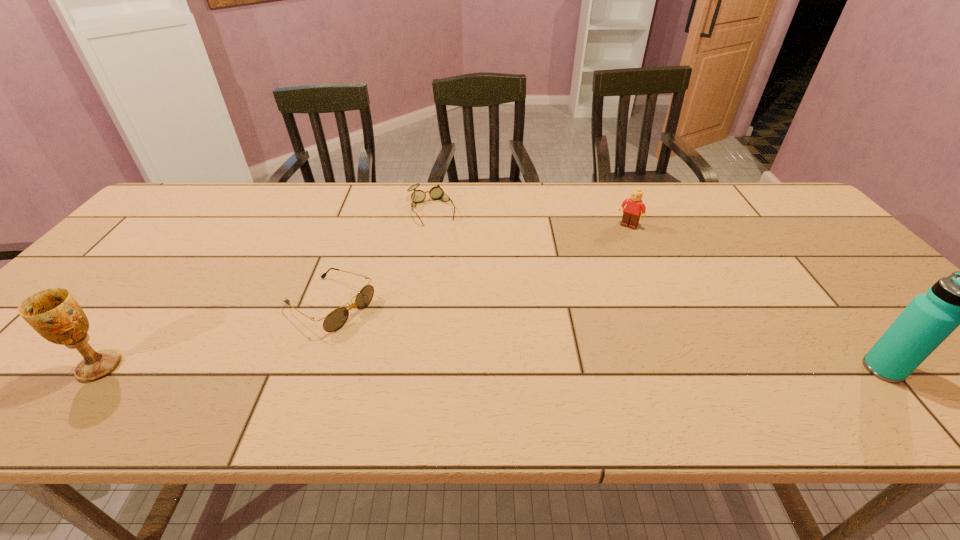
In order to click on free space on the desktop that is between the leftmost object and the rightmost object and is positioned on the front-facing side of the sunglasses in this screenshot , I will do `click(438, 367)`.

You are a GUI agent. You are given a task and a screenshot of the screen. Output one action in this format:
    pyautogui.click(x=<x>, y=<y>)
    Task: Click on the free space on the desktop that is between the fourth shortest object and the tallest object and is positioned on the face of the fourth object from left to right
    The width and height of the screenshot is (960, 540).
    Given the screenshot: What is the action you would take?
    pyautogui.click(x=534, y=368)

You are a GUI agent. You are given a task and a screenshot of the screen. Output one action in this format:
    pyautogui.click(x=<x>, y=<y>)
    Task: Click on the free space on the desktop that is between the chalice and the water bottle and is positioned on the front-facing side of the shortest object
    This screenshot has height=540, width=960.
    Given the screenshot: What is the action you would take?
    pyautogui.click(x=504, y=368)